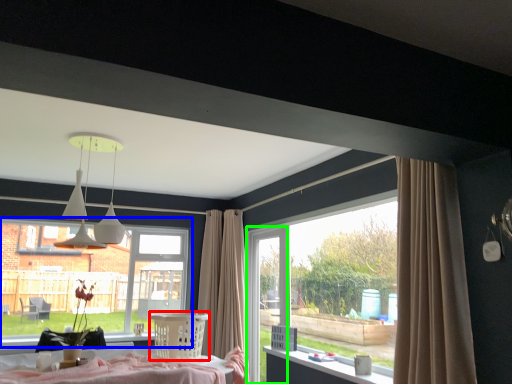
Question: Which object is the closest to the furniture (highlighted by a red box)? Choose among these: window (highlighted by a blue box) or screen door (highlighted by a green box).

Choices:
 (A) window
 (B) screen door

Answer: (A)